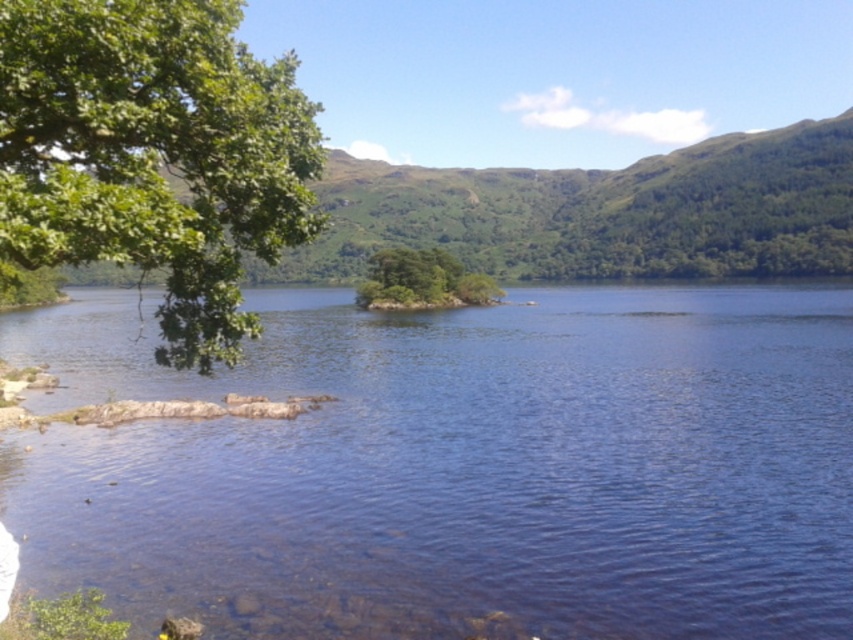
Question: Which of these objects is positioned closest to the clear blue water at center?

Choices:
 (A) green leafy island at center
 (B) green leafy branch at upper left

Answer: (A)

Question: Which is farther from the green leafy branch at upper left?

Choices:
 (A) clear blue water at center
 (B) green leafy island at center

Answer: (B)

Question: Considering the relative positions of clear blue water at center and green leafy branch at upper left in the image provided, where is clear blue water at center located with respect to green leafy branch at upper left?

Choices:
 (A) left
 (B) right

Answer: (A)

Question: Can you confirm if clear blue water at center is bigger than green leafy branch at upper left?

Choices:
 (A) yes
 (B) no

Answer: (A)

Question: Does clear blue water at center have a smaller size compared to green leafy island at center?

Choices:
 (A) no
 (B) yes

Answer: (A)

Question: Estimate the real-world distances between objects in this image. Which object is farther from the green leafy island at center?

Choices:
 (A) clear blue water at center
 (B) green leafy branch at upper left

Answer: (B)